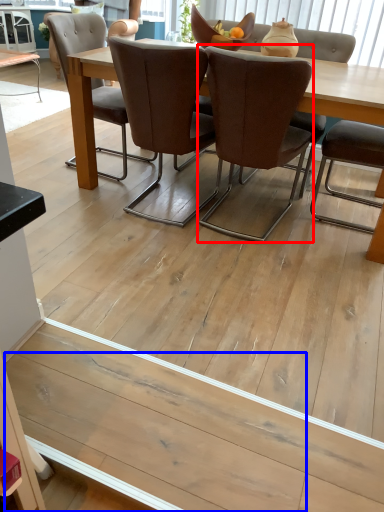
Question: Among these objects, which one is farthest to the camera, chair (highlighted by a red box) or plank (highlighted by a blue box)?

Choices:
 (A) chair
 (B) plank

Answer: (A)